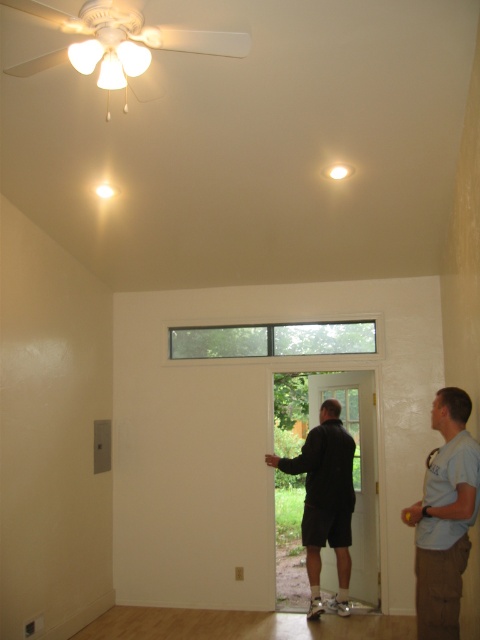
Question: Which of the following is the farthest from the observer?

Choices:
 (A) (445, 422)
 (B) (336, 422)
 (C) (295, 353)

Answer: (C)

Question: Is dark gray shorts at center to the left of clear glass window at center from the viewer's perspective?

Choices:
 (A) yes
 (B) no

Answer: (B)

Question: Which object appears closest to the camera in this image?

Choices:
 (A) light blue t-shirt at right
 (B) clear glass window at center

Answer: (A)

Question: Is light blue t-shirt at right smaller than dark gray shorts at center?

Choices:
 (A) yes
 (B) no

Answer: (A)

Question: Is light blue t-shirt at right further to camera compared to dark gray shorts at center?

Choices:
 (A) no
 (B) yes

Answer: (A)

Question: Which point is farther from the camera taking this photo?

Choices:
 (A) (331, 408)
 (B) (352, 336)

Answer: (B)